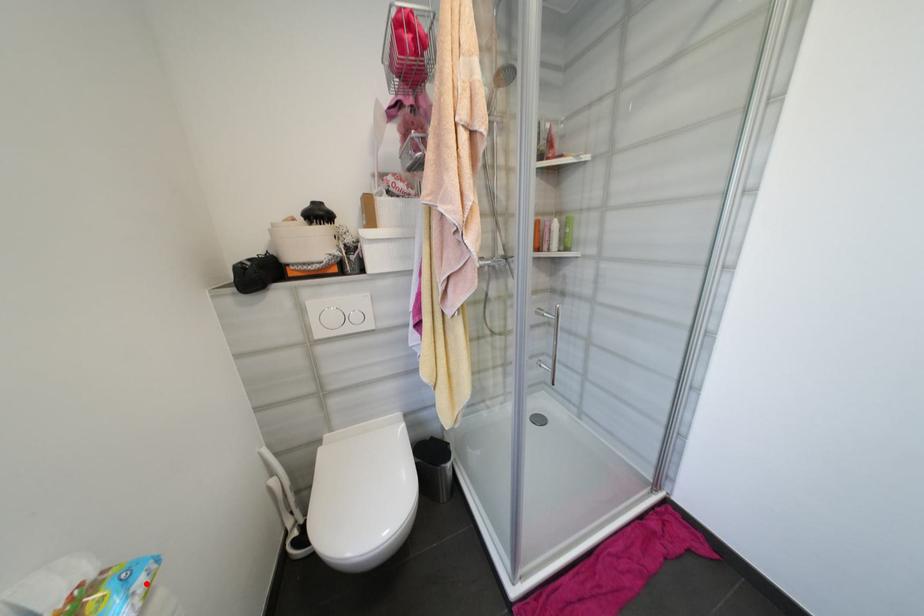
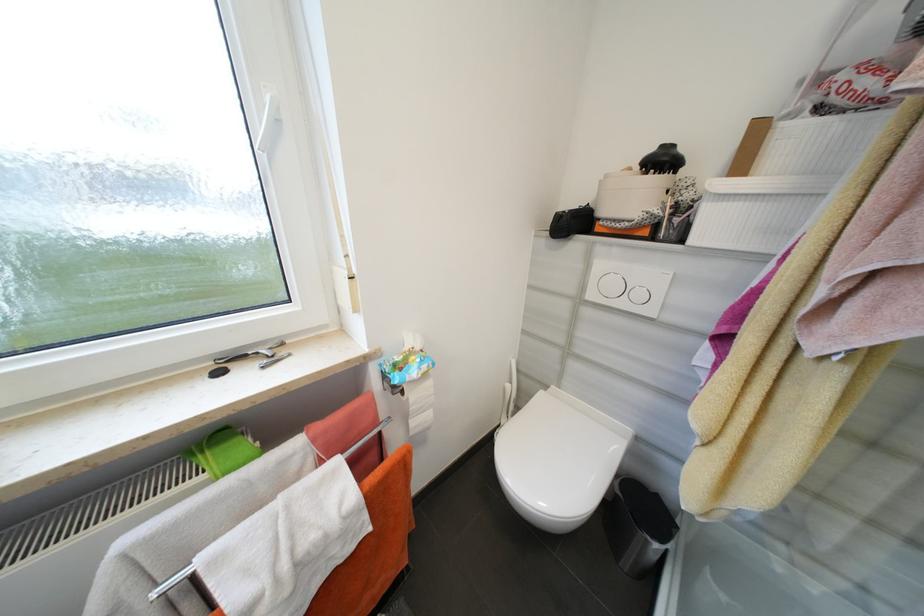
Find the pixel in the second image that matches the highlighted location in the first image.

(430, 368)